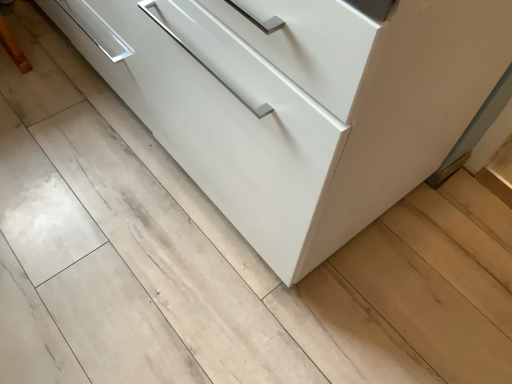
The image size is (512, 384). What do you see at coordinates (298, 103) in the screenshot? I see `white glossy cabinet at center` at bounding box center [298, 103].

Find the location of a particular element. The width and height of the screenshot is (512, 384). white glossy cabinet at center is located at coordinates (298, 103).

The height and width of the screenshot is (384, 512). What are the coordinates of `white glossy cabinet at center` in the screenshot? It's located at (298, 103).